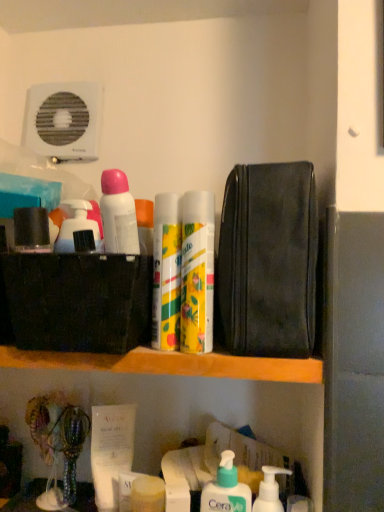
Question: From a real-world perspective, is matte black container at upper left, the fourth toiletry in the bottom-to-top sequence, on yellow matte can at center, which is the second toiletry from right to left?

Choices:
 (A) yes
 (B) no

Answer: (A)

Question: Is matte black container at upper left, the fourth toiletry in the bottom-to-top sequence, far from yellow matte can at center, the 3th toiletry when ordered from top to bottom?

Choices:
 (A) no
 (B) yes

Answer: (A)

Question: Is matte black container at upper left, which ranks as the 5th toiletry in right-to-left order, in front of yellow matte can at center, the 3th toiletry when ordered from top to bottom?

Choices:
 (A) yes
 (B) no

Answer: (A)

Question: Does matte black container at upper left, the second toiletry viewed from the top, have a smaller size compared to yellow matte can at center, the 3th toiletry when ordered from top to bottom?

Choices:
 (A) no
 (B) yes

Answer: (B)

Question: From a real-world perspective, is matte black container at upper left, arranged as the first toiletry when viewed from the left, under yellow matte can at center, the 3th toiletry ordered from the bottom?

Choices:
 (A) yes
 (B) no

Answer: (B)

Question: Is matte black container at upper left, the second toiletry viewed from the top, behind yellow matte can at center, the 3th toiletry when ordered from top to bottom?

Choices:
 (A) yes
 (B) no

Answer: (B)

Question: Can you confirm if white matte deodorant at upper left, placed as the 5th toiletry when sorted from bottom to top, is wider than yellow matte can at center, arranged as the second cleaning product when viewed from the right?

Choices:
 (A) yes
 (B) no

Answer: (B)

Question: Is white matte deodorant at upper left, which ranks as the 2th toiletry in left-to-right order, to the right of yellow matte can at center, arranged as the second cleaning product when viewed from the right, from the viewer's perspective?

Choices:
 (A) no
 (B) yes

Answer: (A)

Question: Does white matte deodorant at upper left, marked as the fourth toiletry in a right-to-left arrangement, have a smaller size compared to yellow matte can at center, which is counted as the first cleaning product, starting from the top?

Choices:
 (A) yes
 (B) no

Answer: (A)

Question: Is white matte deodorant at upper left, marked as the fourth toiletry in a right-to-left arrangement, turned away from yellow matte can at center, the 2th cleaning product ordered from the bottom?

Choices:
 (A) yes
 (B) no

Answer: (B)

Question: Is yellow matte can at center, the 2th cleaning product ordered from the bottom, surrounded by white matte deodorant at upper left, marked as the fourth toiletry in a right-to-left arrangement?

Choices:
 (A) no
 (B) yes

Answer: (A)

Question: Considering the relative sizes of white matte deodorant at upper left, which ranks as the first toiletry in top-to-bottom order, and yellow matte can at center, which is counted as the first cleaning product, starting from the top, in the image provided, is white matte deodorant at upper left, which ranks as the first toiletry in top-to-bottom order, shorter than yellow matte can at center, which is counted as the first cleaning product, starting from the top,?

Choices:
 (A) yes
 (B) no

Answer: (A)

Question: From the image's perspective, is white pump bottle at lower center, the 1th toiletry viewed from the right, below black leather pouch at upper right?

Choices:
 (A) no
 (B) yes

Answer: (B)